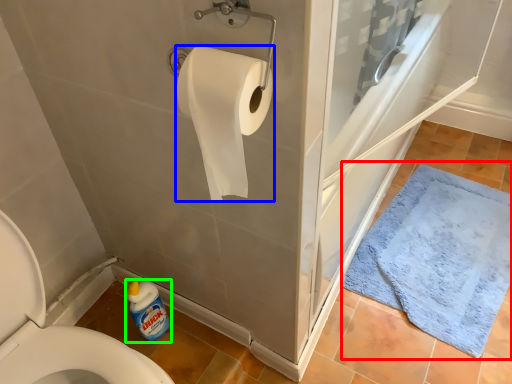
Question: Based on their relative distances, which object is nearer to bath mat (highlighted by a red box)? Choose from toilet paper (highlighted by a blue box) and cleaning product (highlighted by a green box).

Choices:
 (A) toilet paper
 (B) cleaning product

Answer: (B)